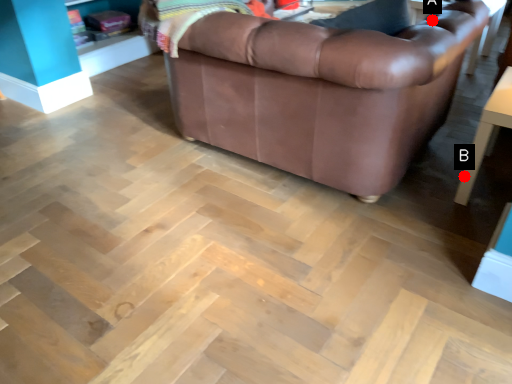
Question: Two points are circled on the image, labeled by A and B beside each circle. Among these points, which one is nearest to the camera?

Choices:
 (A) A is closer
 (B) B is closer

Answer: (B)